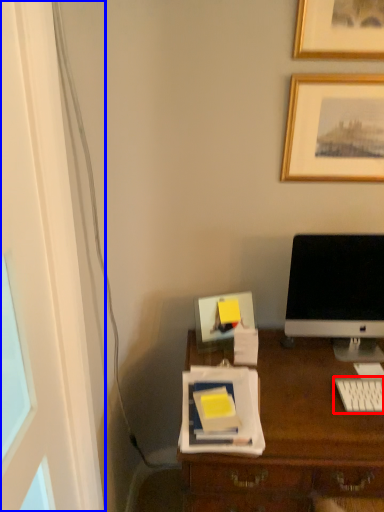
Question: Which point is further to the camera, computer keyboard (highlighted by a red box) or glass door (highlighted by a blue box)?

Choices:
 (A) computer keyboard
 (B) glass door

Answer: (A)